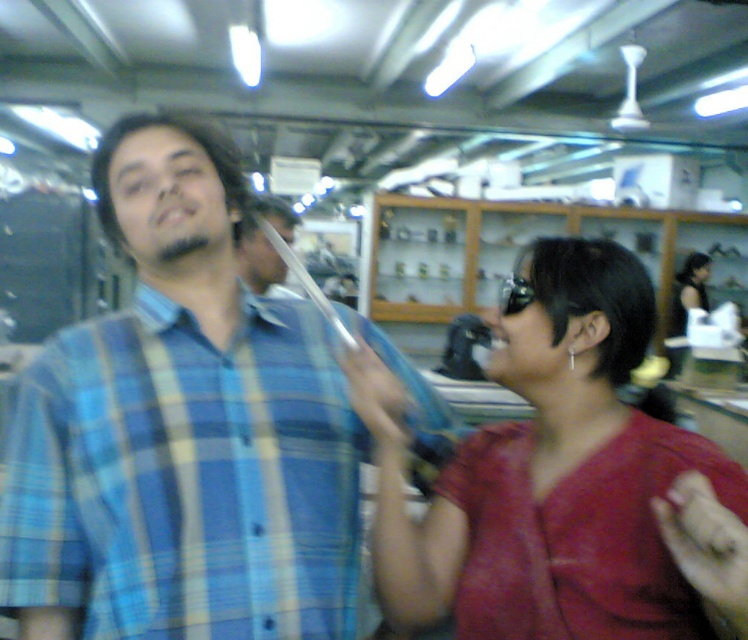
Question: Estimate the real-world distances between objects in this image. Which object is closer to the shiny red fabric at center?

Choices:
 (A) smooth black hair at center
 (B) blue plaid shirt at center

Answer: (B)

Question: Which is nearer to the smooth black hair at center?

Choices:
 (A) shiny red fabric at center
 (B) blue plaid shirt at center

Answer: (B)

Question: Can you confirm if shiny red fabric at center is positioned to the right of smooth black hair at center?

Choices:
 (A) no
 (B) yes

Answer: (B)

Question: In this image, where is blue plaid shirt at center located relative to shiny red fabric at center?

Choices:
 (A) above
 (B) below

Answer: (B)

Question: Which object appears closest to the camera in this image?

Choices:
 (A) shiny red fabric at center
 (B) blue plaid shirt at center

Answer: (A)

Question: Can you confirm if shiny red fabric at center is bigger than smooth black hair at center?

Choices:
 (A) no
 (B) yes

Answer: (A)